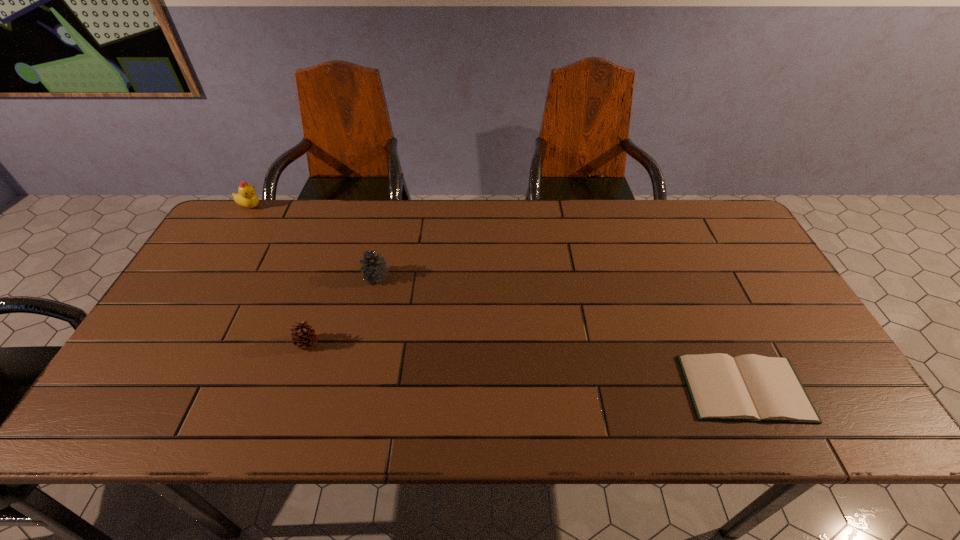
You are a GUI agent. You are given a task and a screenshot of the screen. Output one action in this format:
    pyautogui.click(x=<x>, y=<y>)
    Task: Click on the vacant area between the leftmost object and the nearest object
    
    Given the screenshot: What is the action you would take?
    pyautogui.click(x=497, y=297)

Where is `vacant region between the rightmost object and the farther pinecone`? vacant region between the rightmost object and the farther pinecone is located at coordinates pyautogui.click(x=561, y=333).

Where is `free space between the right pinecone and the leftmost object`? This screenshot has width=960, height=540. free space between the right pinecone and the leftmost object is located at coordinates (313, 242).

I want to click on object that is the closest to the nearest object, so click(375, 270).

Locate an element on the screen. Image resolution: width=960 pixels, height=540 pixels. the second closest object to the left pinecone is located at coordinates (246, 197).

Locate an element on the screen. This screenshot has height=540, width=960. blank area in the image that satisfies the following two spatial constraints: 1. on the back side of the rightmost object; 2. on the front-facing side of the leftmost object is located at coordinates (660, 206).

What are the coordinates of `vacant space that satisfies the following two spatial constraints: 1. on the front-facing side of the nearest object; 2. on the left side of the duckling` in the screenshot? It's located at (142, 388).

The height and width of the screenshot is (540, 960). I want to click on vacant space that satisfies the following two spatial constraints: 1. on the front-facing side of the farther pinecone; 2. on the right side of the duckling, so click(208, 277).

The height and width of the screenshot is (540, 960). I want to click on free location that satisfies the following two spatial constraints: 1. on the front-facing side of the farthest object; 2. on the right side of the nearer pinecone, so click(x=168, y=343).

The image size is (960, 540). Find the location of `free space that satisfies the following two spatial constraints: 1. on the front-facing side of the third object from right to left; 2. on the left side of the duckling`. free space that satisfies the following two spatial constraints: 1. on the front-facing side of the third object from right to left; 2. on the left side of the duckling is located at coordinates (168, 343).